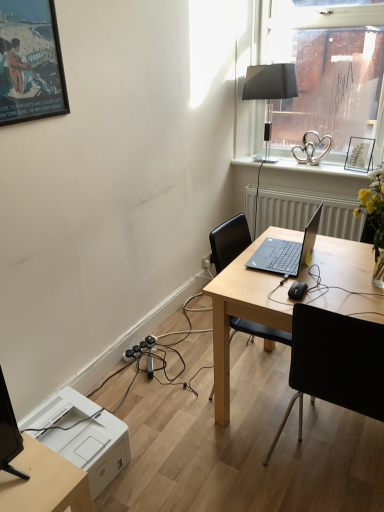
Question: Is light wood desk at center taller or shorter than matte black picture frame at upper left, the 2th picture frame from the back?

Choices:
 (A) short
 (B) tall

Answer: (B)

Question: Based on their positions, is light wood desk at center located to the left or right of matte black picture frame at upper left, the 2th picture frame from the back?

Choices:
 (A) right
 (B) left

Answer: (A)

Question: Which object is the closest to the white textured radiator at center?

Choices:
 (A) white plastic printer at lower left
 (B) transparent glass window at upper right
 (C) sleek black laptop at center
 (D) black fabric lampshade at upper right
 (E) matte black picture frame at upper left, the first picture frame positioned from the left

Answer: (B)

Question: Which object is positioned farthest from the white plastic printer at lower left?

Choices:
 (A) transparent glass window at upper right
 (B) black fabric chair at center
 (C) silver metallic heart at upper right
 (D) black fabric lampshade at upper right
 (E) light wood desk at center

Answer: (A)